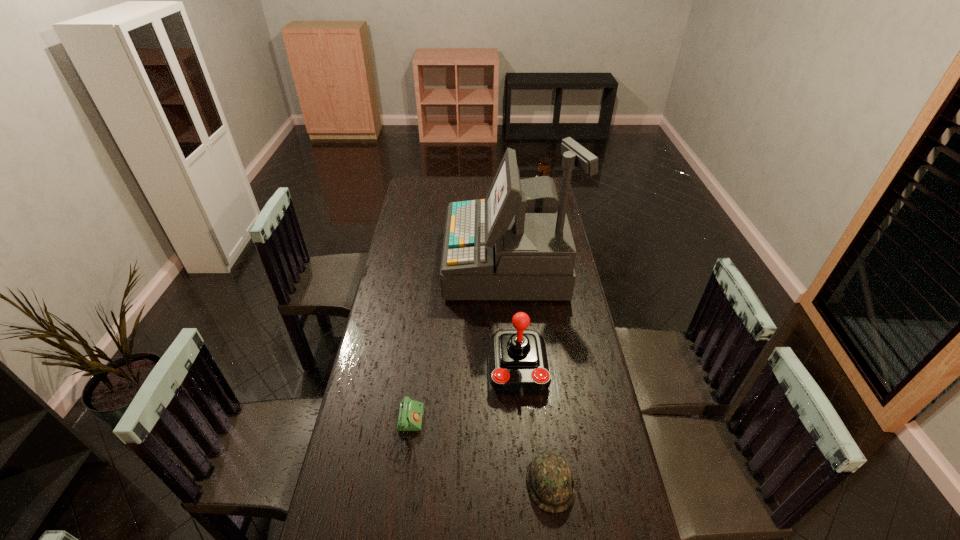
Find the location of a particular element. cash register is located at coordinates (516, 244).

You are a GUI agent. You are given a task and a screenshot of the screen. Output one action in this format:
    pyautogui.click(x=<x>, y=<y>)
    Task: Click on the second farthest object
    This screenshot has width=960, height=540.
    Given the screenshot: What is the action you would take?
    pyautogui.click(x=516, y=244)

At what (x,y) coordinates should I click in order to perform the action: click on lantern. Please return your answer as a coordinate pair (x, y). The width and height of the screenshot is (960, 540). Looking at the image, I should click on (543, 167).

I want to click on joystick, so click(518, 365).

Locate an element on the screen. The height and width of the screenshot is (540, 960). headwear is located at coordinates (550, 482).

You are a GUI agent. You are given a task and a screenshot of the screen. Output one action in this format:
    pyautogui.click(x=<x>, y=<y>)
    Task: Click on the telephone
    The height and width of the screenshot is (540, 960).
    Given the screenshot: What is the action you would take?
    pyautogui.click(x=410, y=414)

The image size is (960, 540). What are the coordinates of `the shortest object` in the screenshot? It's located at (410, 414).

The height and width of the screenshot is (540, 960). I want to click on blank space located on the customer-facing side of the cash register, so click(x=429, y=264).

Locate an element on the screen. The height and width of the screenshot is (540, 960). free space located on the customer-facing side of the cash register is located at coordinates (413, 264).

Identify the location of free location located on the customer-facing side of the cash register. (399, 264).